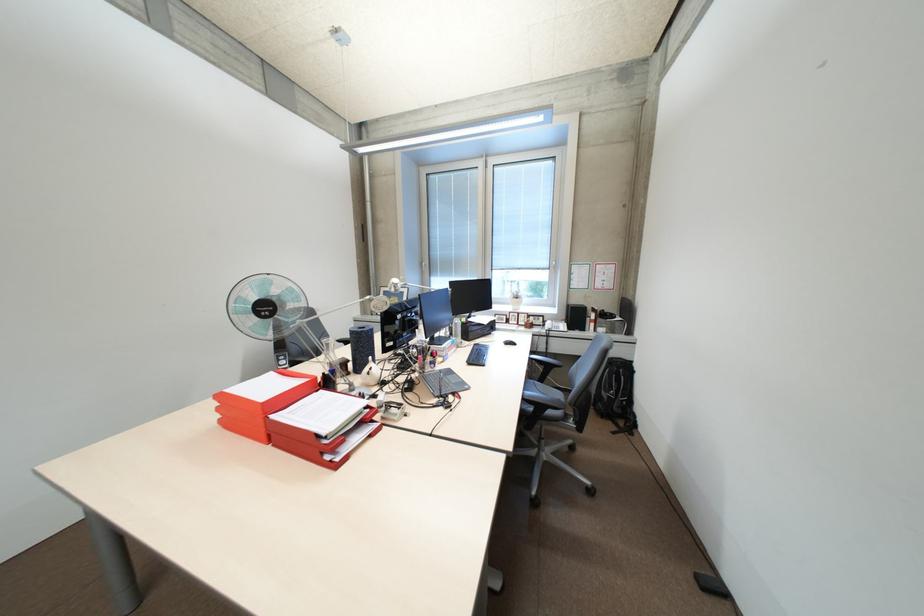
Find where to lift the grey laptop. Please return your answer as a coordinate pair (x, y).

(439, 381)